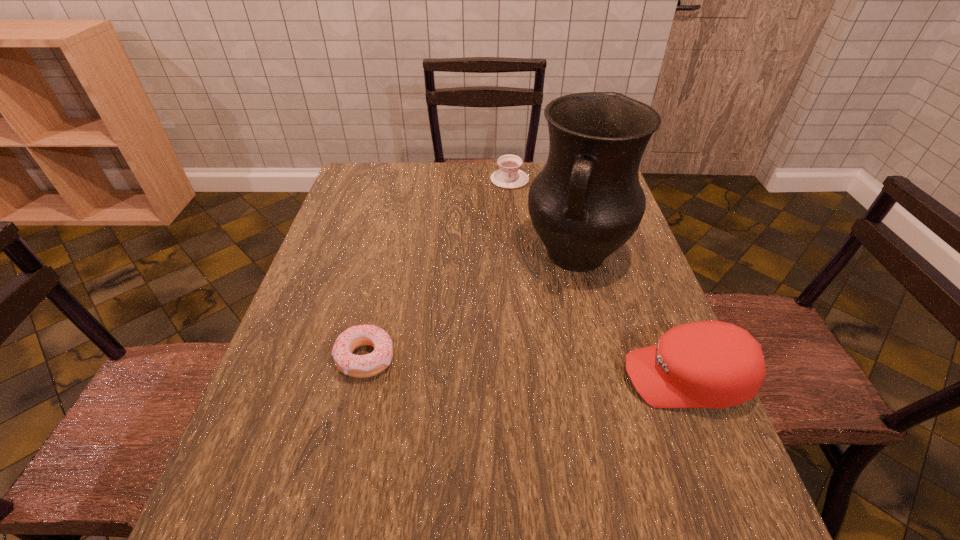
This screenshot has width=960, height=540. I want to click on pitcher that is at the right edge, so pyautogui.click(x=587, y=202).

Locate an element on the screen. The width and height of the screenshot is (960, 540). vacant space at the near edge is located at coordinates (510, 462).

I want to click on vacant region at the left edge of the desktop, so click(x=352, y=231).

Locate an element on the screen. Image resolution: width=960 pixels, height=540 pixels. vacant position at the right edge of the desktop is located at coordinates (654, 328).

Locate an element on the screen. free space between the pitcher and the cap is located at coordinates (631, 316).

Identify the location of vacant area that lies between the second shortest object and the cap. (598, 279).

Where is `empty space that is in between the tallest object and the second tallest object`? This screenshot has height=540, width=960. empty space that is in between the tallest object and the second tallest object is located at coordinates click(631, 316).

Identify the location of empty space between the leftmost object and the tallest object. This screenshot has height=540, width=960. (470, 306).

Locate an element on the screen. The width and height of the screenshot is (960, 540). vacant area between the farthest object and the doughnut is located at coordinates (438, 268).

Locate an element on the screen. The width and height of the screenshot is (960, 540). vacant area that lies between the second shortest object and the doughnut is located at coordinates (438, 268).